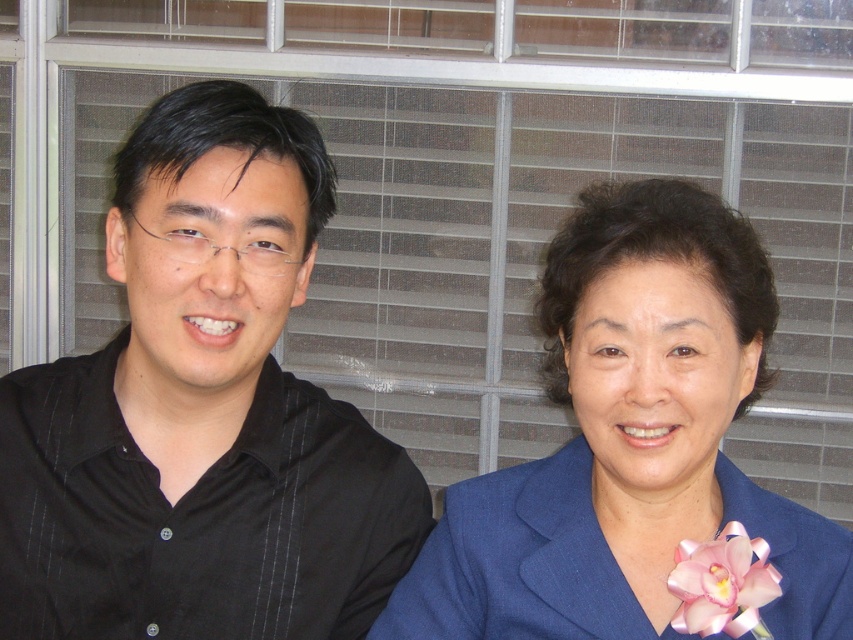
Does black pinstripe shirt at left have a greater width compared to pink satin flower at lower right?

Indeed, black pinstripe shirt at left has a greater width compared to pink satin flower at lower right.

Is point (262, 157) more distant than point (709, 600)?

That is True.

Identify the location of black pinstripe shirt at left. The width and height of the screenshot is (853, 640). pyautogui.click(x=201, y=412).

Which is above, black pinstripe shirt at left or blue fabric jacket at right?

Positioned higher is black pinstripe shirt at left.

From the picture: Can you confirm if black pinstripe shirt at left is bigger than blue fabric jacket at right?

Yes.

Is point (79, 476) positioned in front of point (627, 579)?

That is False.

This screenshot has height=640, width=853. What are the coordinates of `black pinstripe shirt at left` in the screenshot? It's located at (201, 412).

Who is positioned more to the right, blue fabric jacket at right or pink satin flower at lower right?

Positioned to the right is pink satin flower at lower right.

Between point (576, 634) and point (727, 589), which one is positioned behind?

The point (576, 634) is behind.

Does point (679, 346) come farther from viewer compared to point (697, 618)?

No, it is in front of (697, 618).

At what (x,y) coordinates should I click in order to perform the action: click on blue fabric jacket at right. Please return your answer as a coordinate pair (x, y). The width and height of the screenshot is (853, 640). Looking at the image, I should click on (636, 454).